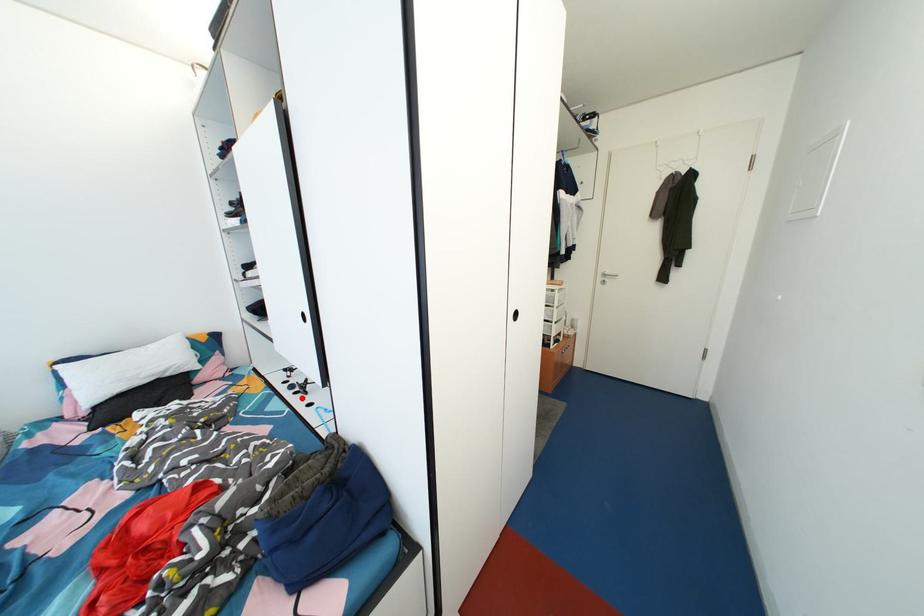
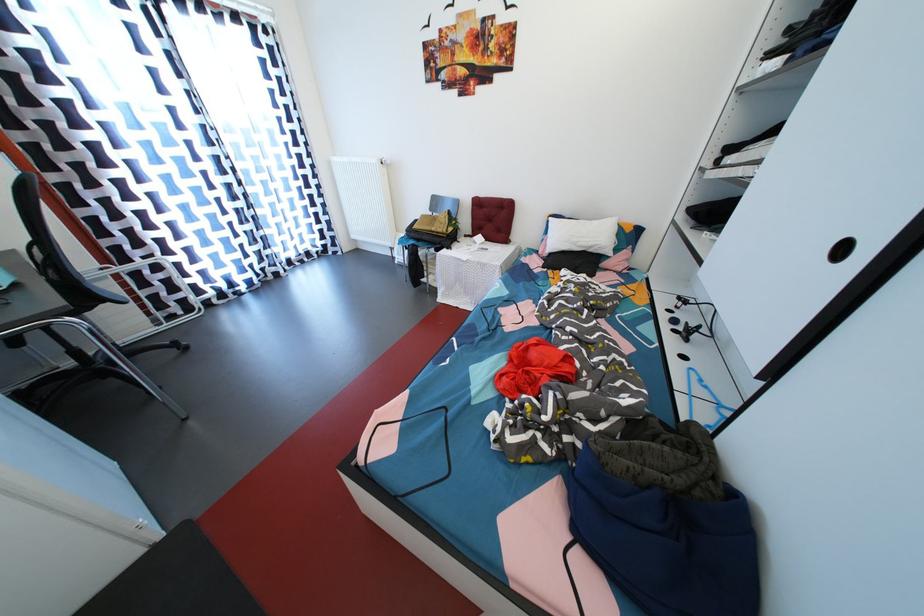
Question: I am providing you with two images of the same scene from different viewpoints. In image1, a red point is highlighted. Considering the same 3D point in image2, which of the following is correct?

Choices:
 (A) It is closer
 (B) It is farther

Answer: (A)